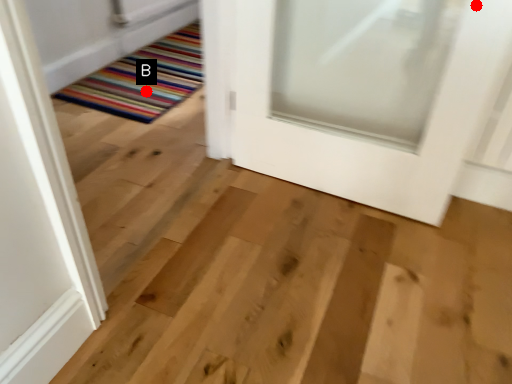
Question: Two points are circled on the image, labeled by A and B beside each circle. Which point is farther from the camera taking this photo?

Choices:
 (A) A is further
 (B) B is further

Answer: (B)